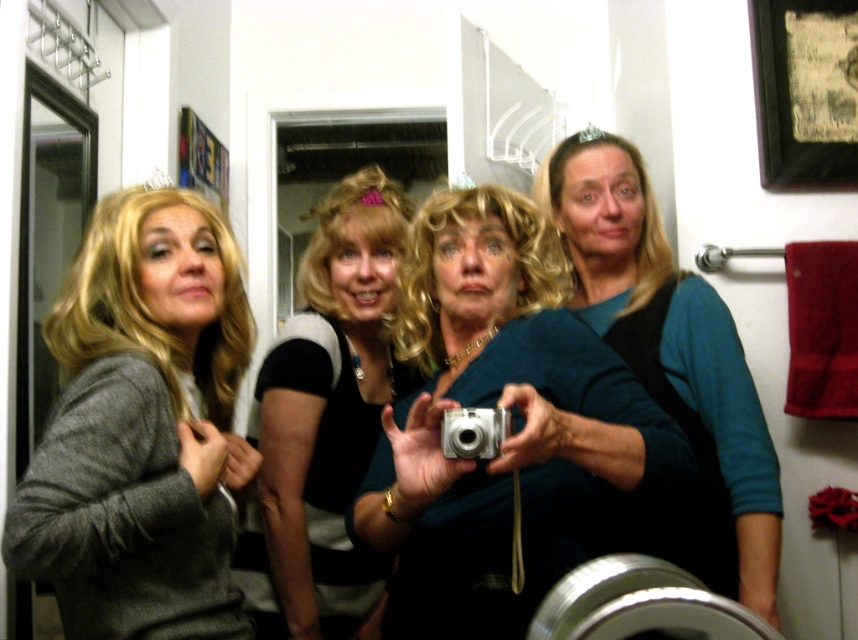
Who is taller, gray woolen sweater at left or black and white striped shirt at center?

black and white striped shirt at center

Is point (177, 616) farther from viewer compared to point (354, 372)?

No.

Describe the element at coordinates (140, 428) in the screenshot. This screenshot has width=858, height=640. I see `gray woolen sweater at left` at that location.

You are a GUI agent. You are given a task and a screenshot of the screen. Output one action in this format:
    pyautogui.click(x=<x>, y=<y>)
    Task: Click on the gray woolen sweater at left
    This screenshot has width=858, height=640.
    Given the screenshot: What is the action you would take?
    pyautogui.click(x=140, y=428)

Can you confirm if metallic silver camera at center is positioned below gray woolen sweater at left?

Correct, metallic silver camera at center is located below gray woolen sweater at left.

Who is higher up, metallic silver camera at center or gray woolen sweater at left?

gray woolen sweater at left is higher up.

In order to click on metallic silver camera at center in this screenshot , I will do `click(511, 428)`.

Identify the location of metallic silver camera at center. (511, 428).

Does point (68, 360) come farther from viewer compared to point (774, 573)?

That is False.

Can you confirm if gray woolen sweater at left is bigger than teal fabric top at center?

Actually, gray woolen sweater at left might be smaller than teal fabric top at center.

Which is in front, point (107, 371) or point (724, 332)?

Point (107, 371)

Identify the location of gray woolen sweater at left. The width and height of the screenshot is (858, 640). (140, 428).